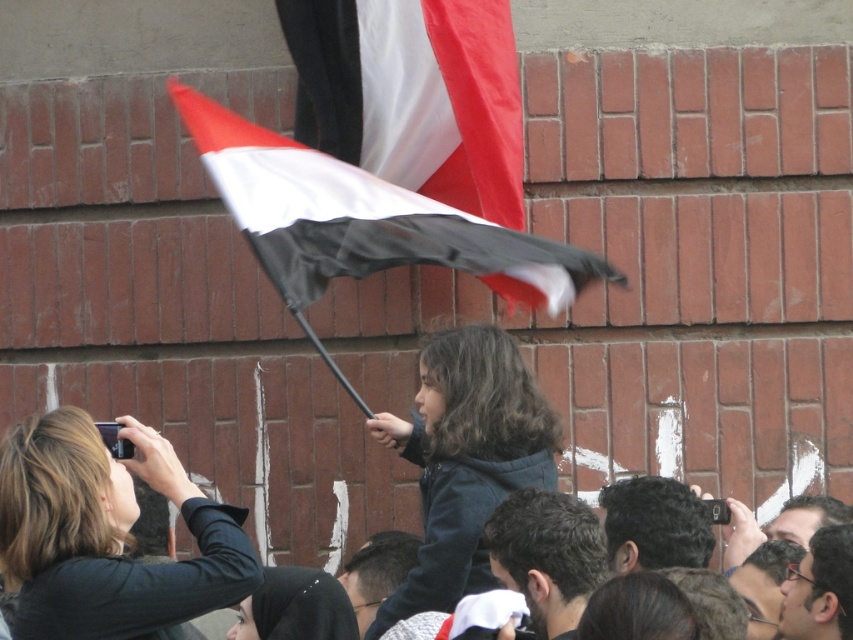
Question: Does red-white-black fabric flag at upper center come in front of matte black glasses at center?

Choices:
 (A) no
 (B) yes

Answer: (A)

Question: Does black matte flag at center appear on the right side of matte black glasses at center?

Choices:
 (A) yes
 (B) no

Answer: (B)

Question: Which of the following is the farthest from the observer?

Choices:
 (A) (271, 173)
 (B) (820, 582)

Answer: (A)

Question: Which object is positioned closest to the matte black glasses at center?

Choices:
 (A) red-white-black fabric flag at upper center
 (B) dark brown hair at lower center
 (C) dark brown hair at center
 (D) black matte flag at center

Answer: (C)

Question: Which object is positioned farthest from the black matte flag at center?

Choices:
 (A) red-white-black fabric flag at upper center
 (B) dark brown hair at lower center

Answer: (B)

Question: Is red-white-black fabric flag at upper center wider than black matte flag at center?

Choices:
 (A) no
 (B) yes

Answer: (A)